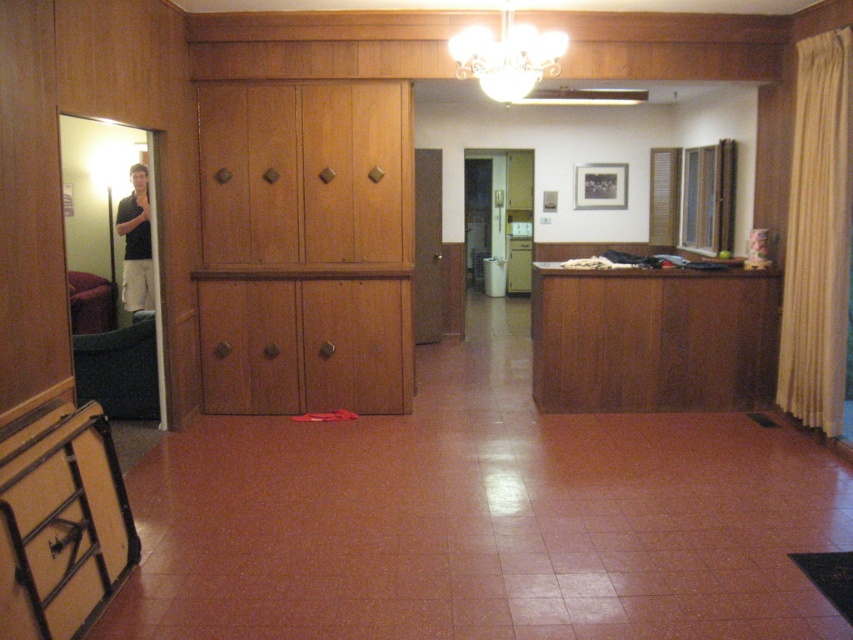
Question: Can you confirm if wooden dresser at center is bigger than white glass chandelier at upper center?

Choices:
 (A) yes
 (B) no

Answer: (A)

Question: Can you confirm if wooden cabinet at center is positioned to the right of beige fabric curtain at right?

Choices:
 (A) no
 (B) yes

Answer: (A)

Question: Which of the following is the closest to the observer?

Choices:
 (A) white glass chandelier at upper center
 (B) wooden cabinet at center
 (C) matte black drawer at lower left

Answer: (C)

Question: Which of these objects is positioned farthest from the beige fabric curtain at right?

Choices:
 (A) wooden dresser at center
 (B) white glass chandelier at upper center
 (C) matte black drawer at lower left

Answer: (C)

Question: Which of these objects is positioned farthest from the wooden cabinet at center?

Choices:
 (A) white glass chandelier at upper center
 (B) wooden dresser at center

Answer: (A)

Question: Can you confirm if wooden cabinet at center is positioned above matte black drawer at lower left?

Choices:
 (A) no
 (B) yes

Answer: (B)